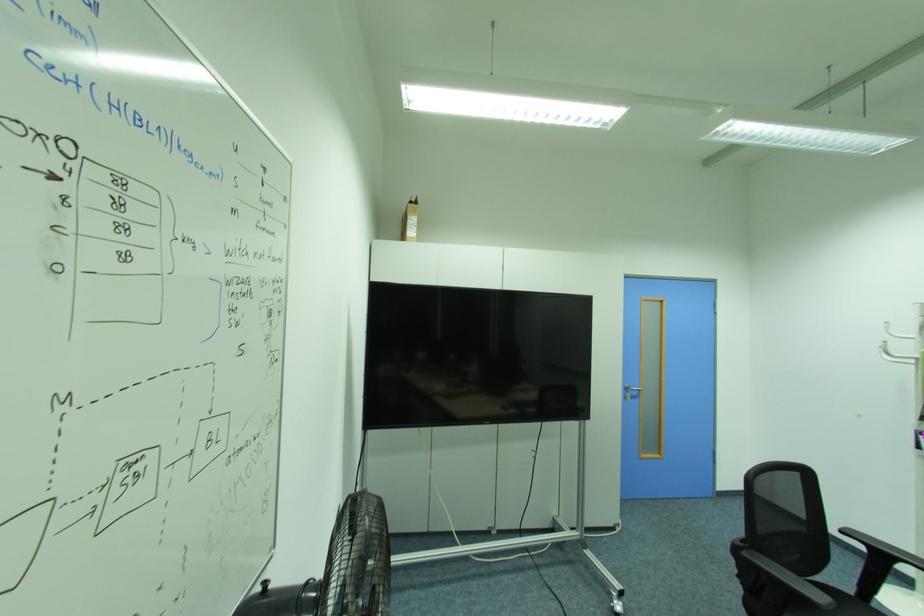
Locate an element on the screen. The width and height of the screenshot is (924, 616). TV stand wheel is located at coordinates (616, 605).